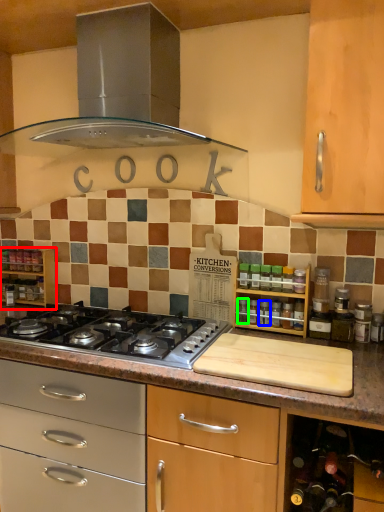
Question: Based on their relative distances, which object is farther from shelf (highlighted by a red box)? Choose from appliance (highlighted by a blue box) and bottle (highlighted by a green box).

Choices:
 (A) appliance
 (B) bottle

Answer: (A)